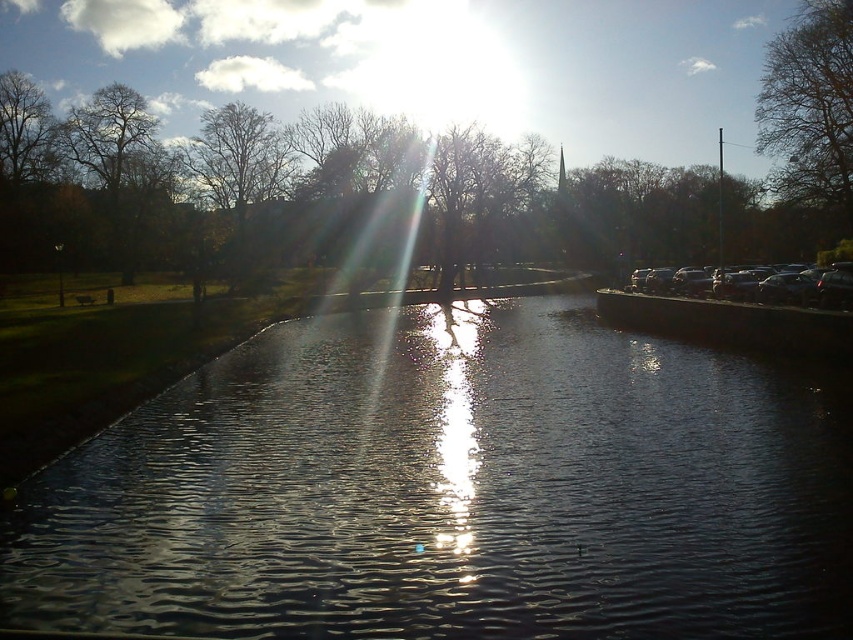
You are standing at the center of the image and want to locate the brown leafless tree at upper right. In which direction should you look relative to your position?

The brown leafless tree at upper right is located at point coordinates, so you should look towards the upper right direction from your current position at the center.

You are an artist trying to paint the scene. You notice the shiny dark water at center and the brown leafless tree at upper left. Which object should you paint first if you want to follow the rule of painting smaller objects before larger ones?

The shiny dark water at center has a smaller size compared to the brown leafless tree at upper left, so you should paint the shiny dark water at center first.

You are standing at the edge of the water in the image. There is a point marked at coordinates (451,490). Based on the scene description, can you determine if this point is on the water or on the trees in the background?

The point (451,490) is on shiny dark water at center, so it is on the water.